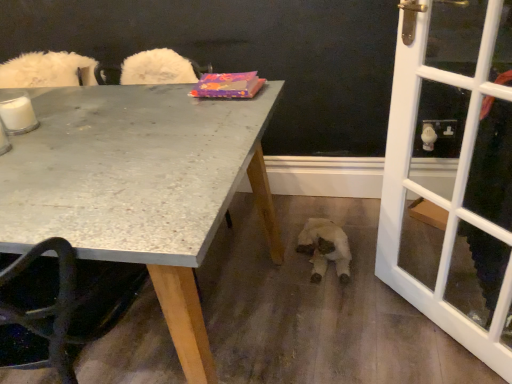
Question: From the image's perspective, is granite gray table at upper left located beneath white glass screen door at right?

Choices:
 (A) no
 (B) yes

Answer: (B)

Question: Considering the relative sizes of granite gray table at upper left and white glass screen door at right in the image provided, is granite gray table at upper left shorter than white glass screen door at right?

Choices:
 (A) no
 (B) yes

Answer: (B)

Question: Considering the relative sizes of granite gray table at upper left and white glass screen door at right in the image provided, is granite gray table at upper left smaller than white glass screen door at right?

Choices:
 (A) no
 (B) yes

Answer: (A)

Question: Could you tell me if granite gray table at upper left is facing white glass screen door at right?

Choices:
 (A) yes
 (B) no

Answer: (B)

Question: Is granite gray table at upper left located outside white glass screen door at right?

Choices:
 (A) no
 (B) yes

Answer: (B)

Question: Is granite gray table at upper left surrounding white glass screen door at right?

Choices:
 (A) yes
 (B) no

Answer: (B)

Question: Is white glass screen door at right oriented away from white plush toy at lower center?

Choices:
 (A) no
 (B) yes

Answer: (A)

Question: Is white glass screen door at right beside white plush toy at lower center?

Choices:
 (A) yes
 (B) no

Answer: (B)

Question: Is white glass screen door at right positioned before white plush toy at lower center?

Choices:
 (A) yes
 (B) no

Answer: (A)

Question: Does white glass screen door at right have a smaller size compared to white plush toy at lower center?

Choices:
 (A) yes
 (B) no

Answer: (B)

Question: From a real-world perspective, is white glass screen door at right below white plush toy at lower center?

Choices:
 (A) yes
 (B) no

Answer: (B)

Question: Is white glass screen door at right to the right of white plush toy at lower center from the viewer's perspective?

Choices:
 (A) no
 (B) yes

Answer: (B)

Question: Is there a large distance between white plush toy at lower center and white glass screen door at right?

Choices:
 (A) no
 (B) yes

Answer: (A)